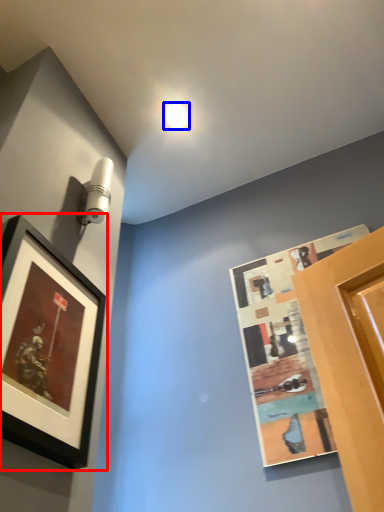
Question: Which of the following is the closest to the observer, picture frame (highlighted by a red box) or droplight (highlighted by a blue box)?

Choices:
 (A) picture frame
 (B) droplight

Answer: (A)